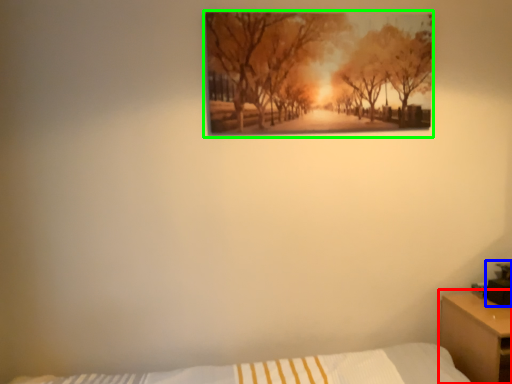
Question: Estimate the real-world distances between objects in this image. Which object is farther from nightstand (highlighted by a red box), table lamp (highlighted by a blue box) or picture frame (highlighted by a green box)?

Choices:
 (A) table lamp
 (B) picture frame

Answer: (B)